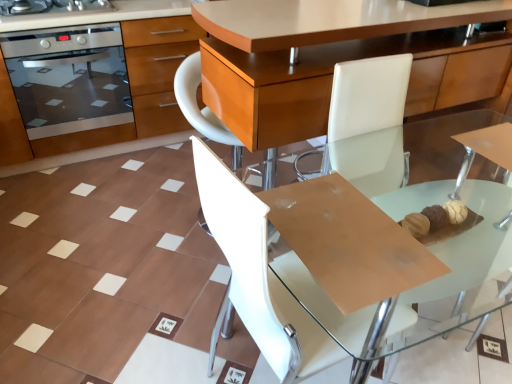
Question: Is stainless steel oven at left smaller than stainless steel oven at left?

Choices:
 (A) no
 (B) yes

Answer: (B)

Question: From a real-world perspective, is stainless steel oven at left below stainless steel oven at left?

Choices:
 (A) no
 (B) yes

Answer: (A)

Question: Does stainless steel oven at left have a larger size compared to stainless steel oven at left?

Choices:
 (A) yes
 (B) no

Answer: (B)

Question: From a real-world perspective, is stainless steel oven at left over stainless steel oven at left?

Choices:
 (A) no
 (B) yes

Answer: (B)

Question: From the image's perspective, is stainless steel oven at left located above stainless steel oven at left?

Choices:
 (A) no
 (B) yes

Answer: (B)

Question: Is stainless steel oven at left located outside stainless steel oven at left?

Choices:
 (A) no
 (B) yes

Answer: (A)

Question: Is white leather chair at center not near stainless steel oven at left?

Choices:
 (A) no
 (B) yes

Answer: (B)

Question: Can you confirm if white leather chair at center is smaller than stainless steel oven at left?

Choices:
 (A) no
 (B) yes

Answer: (B)

Question: From a real-world perspective, is white leather chair at center over stainless steel oven at left?

Choices:
 (A) no
 (B) yes

Answer: (A)

Question: From the image's perspective, would you say white leather chair at center is shown under stainless steel oven at left?

Choices:
 (A) yes
 (B) no

Answer: (A)

Question: Is white leather chair at center positioned behind stainless steel oven at left?

Choices:
 (A) yes
 (B) no

Answer: (B)

Question: Does white leather chair at center have a greater height compared to stainless steel oven at left?

Choices:
 (A) no
 (B) yes

Answer: (B)

Question: Is white leather chair at center facing away from stainless steel oven at upper left?

Choices:
 (A) yes
 (B) no

Answer: (B)